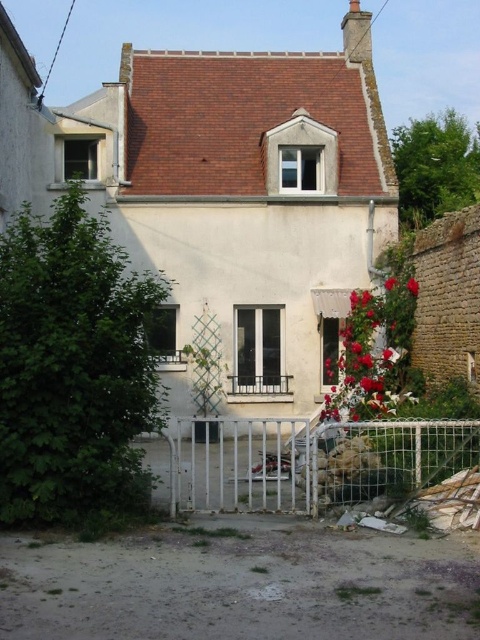
Question: Can you confirm if white metal gate at lower center is wider than vivid red petals at center?

Choices:
 (A) yes
 (B) no

Answer: (A)

Question: Which of the following is the farthest from the observer?

Choices:
 (A) (213, 508)
 (B) (343, 378)

Answer: (B)

Question: Does white metal gate at lower center appear on the left side of vivid red petals at center?

Choices:
 (A) no
 (B) yes

Answer: (B)

Question: Which of the following is the closest to the observer?

Choices:
 (A) (372, 323)
 (B) (389, 452)

Answer: (B)

Question: In this image, where is white metal gate at lower center located relative to vivid red petals at center?

Choices:
 (A) above
 (B) below

Answer: (B)